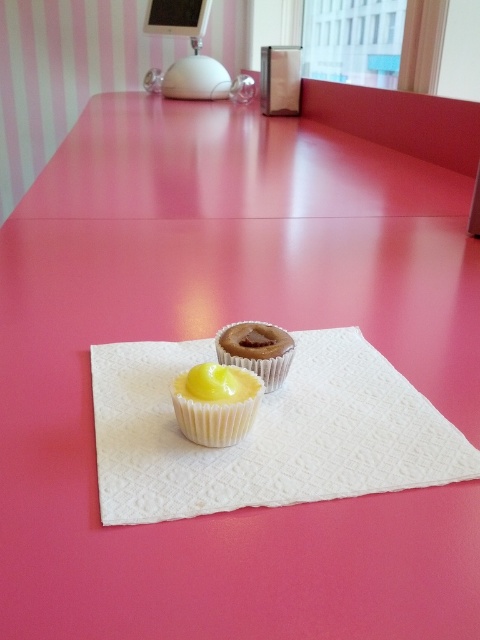
Where is `yellow matte muffin at center`? This screenshot has width=480, height=640. yellow matte muffin at center is located at coordinates (216, 403).

Which is in front, point (178, 413) or point (273, 353)?

Point (178, 413)

Identify the location of yellow matte muffin at center. The image size is (480, 640). (216, 403).